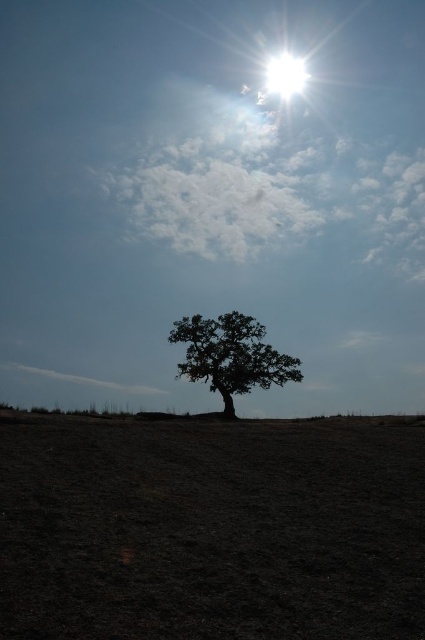
Consider the image. Does silhouette leafy tree at center have a smaller size compared to bright white sun at upper center?

No, silhouette leafy tree at center is not smaller than bright white sun at upper center.

Can you confirm if silhouette leafy tree at center is taller than bright white sun at upper center?

Yes, silhouette leafy tree at center is taller than bright white sun at upper center.

Who is more distant from viewer, (249, 326) or (280, 81)?

The point (280, 81) is behind.

Locate an element on the screen. silhouette leafy tree at center is located at coordinates (231, 355).